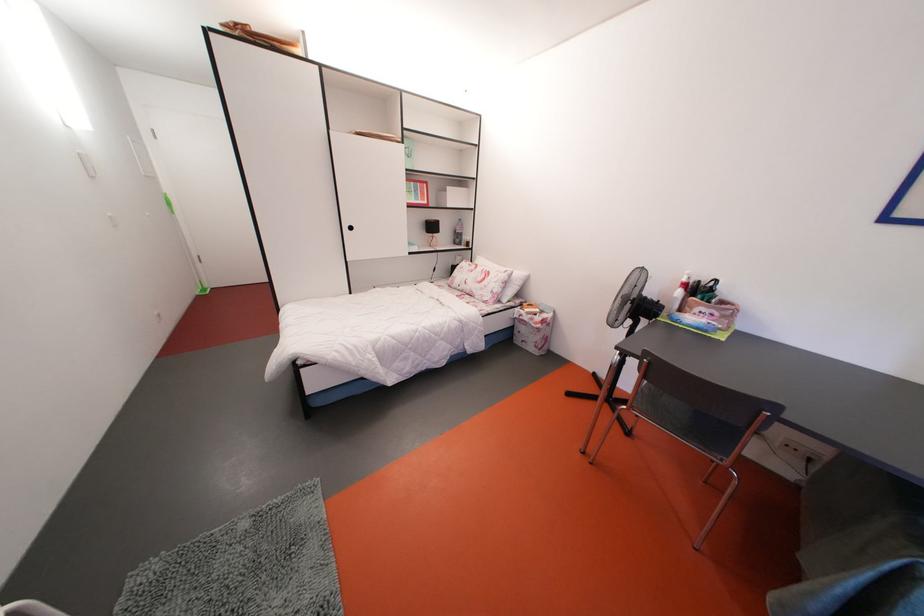
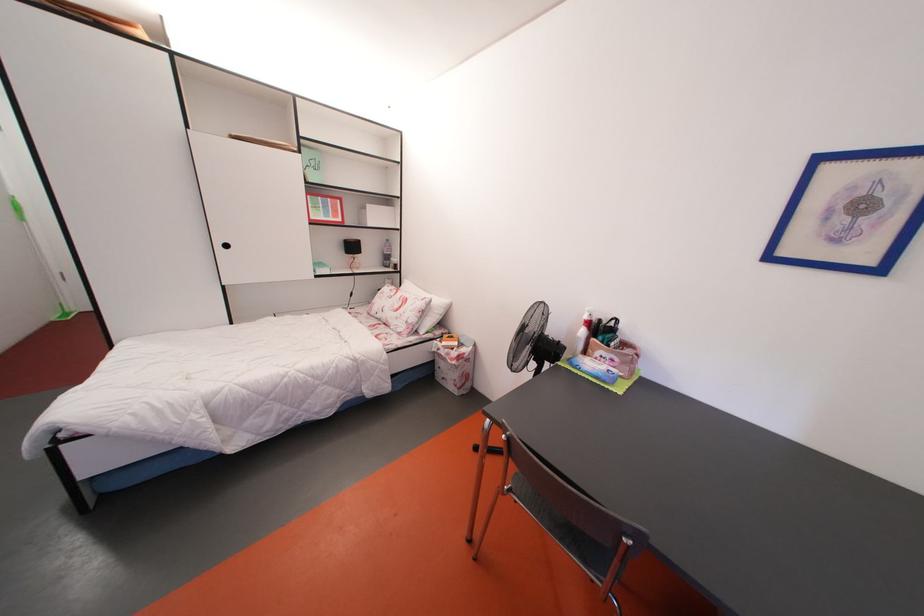
Where in the second image is the point corresponding to point (439, 233) from the first image?

(359, 253)